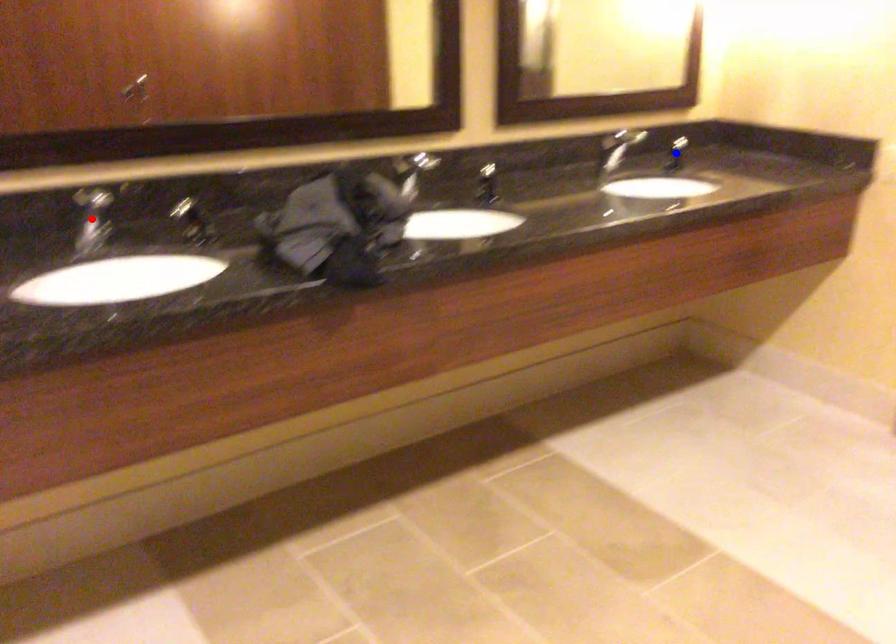
Question: Which of the two points in the image is closer to the camera?

Choices:
 (A) Blue point is closer.
 (B) Red point is closer.

Answer: (B)